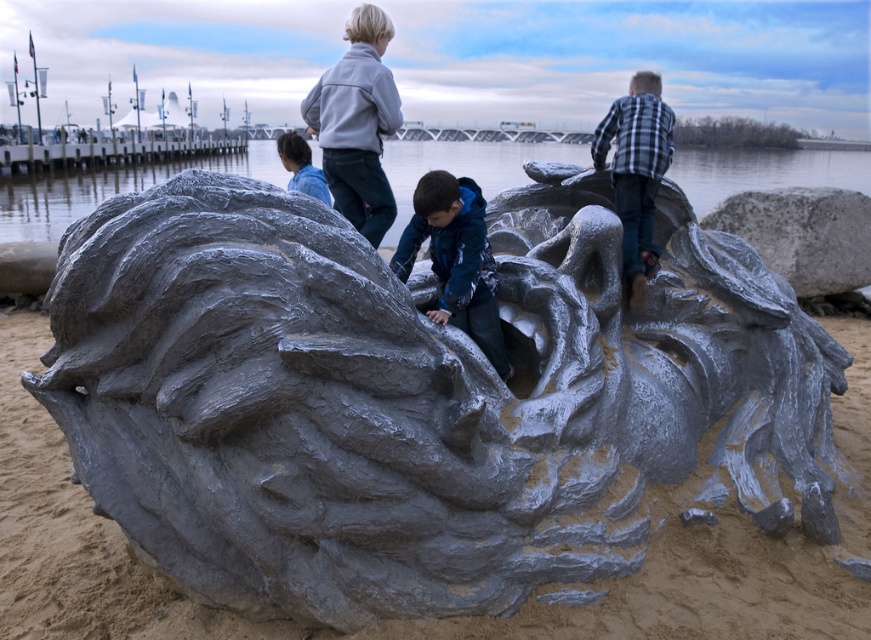
Does clear water at center appear on the right side of checkered flannel shirt at upper right?

Incorrect, clear water at center is not on the right side of checkered flannel shirt at upper right.

Who is more distant from viewer, (x=387, y=243) or (x=608, y=145)?

Point (x=387, y=243)

Who is more distant from viewer, (707, 192) or (637, 115)?

The point (707, 192) is more distant.

The width and height of the screenshot is (871, 640). What are the coordinates of `clear water at center` in the screenshot? It's located at (107, 189).

Is gray matte sculpture at center closer to the viewer compared to clear water at center?

Yes.

Consider the image. Which is above, gray matte sculpture at center or clear water at center?

Positioned higher is clear water at center.

Which is behind, point (583, 454) or point (760, 179)?

Positioned behind is point (760, 179).

Image resolution: width=871 pixels, height=640 pixels. I want to click on gray matte sculpture at center, so click(x=422, y=400).

Can you confirm if gray matte rock at upper right is positioned to the right of checkered flannel shirt at upper right?

Yes, gray matte rock at upper right is to the right of checkered flannel shirt at upper right.

Does gray matte rock at upper right appear over checkered flannel shirt at upper right?

Yes.

Which is behind, point (798, 275) or point (643, 86)?

Positioned behind is point (798, 275).

This screenshot has height=640, width=871. I want to click on gray matte rock at upper right, so click(x=802, y=234).